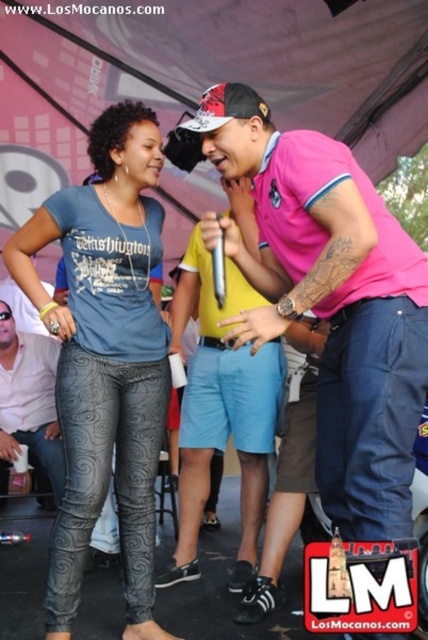
Question: Which point is farther to the camera?

Choices:
 (A) (394, 310)
 (B) (38, 410)
 (C) (98, 403)
 (D) (246, 564)

Answer: (B)

Question: Does pink cotton shirt at center lie behind metallic gray leggings at center?

Choices:
 (A) no
 (B) yes

Answer: (A)

Question: Which object is the farthest from the pink cotton shirt at center?

Choices:
 (A) matte yellow shirt at center
 (B) black textured leggings at center

Answer: (B)

Question: In this image, where is black textured leggings at center located relative to matte yellow shirt at center?

Choices:
 (A) left
 (B) right

Answer: (A)

Question: Which of these objects is positioned farthest from the metallic gray leggings at center?

Choices:
 (A) white matte shirt at center
 (B) black textured leggings at center
 (C) matte yellow shirt at center
 (D) pink cotton shirt at center

Answer: (A)

Question: Can you confirm if pink cotton shirt at center is positioned above white matte shirt at center?

Choices:
 (A) no
 (B) yes

Answer: (B)